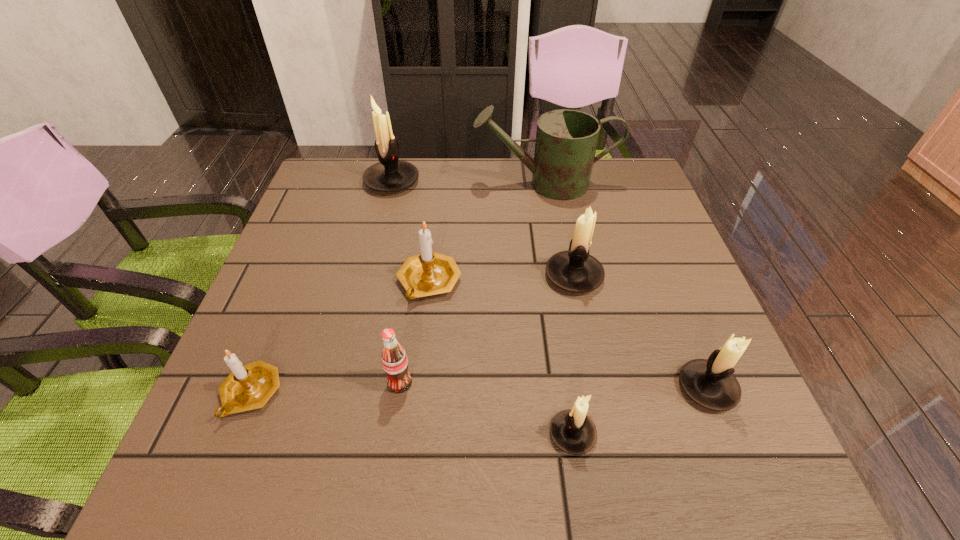
Image resolution: width=960 pixels, height=540 pixels. I want to click on vacant region located 0.210m on the back of the soda, so click(x=413, y=290).

Find the location of a particular element. The image size is (960, 540). free region located on the right of the leftmost object is located at coordinates (348, 393).

You are a GUI agent. You are given a task and a screenshot of the screen. Output one action in this format:
    pyautogui.click(x=<x>, y=<y>)
    Task: Click on the free space located 0.080m on the left of the smallest white candle holder
    
    Given the screenshot: What is the action you would take?
    pyautogui.click(x=502, y=434)

You are a GUI agent. You are given a task and a screenshot of the screen. Output one action in this format:
    pyautogui.click(x=<x>, y=<y>)
    Task: Click on the candle holder located at the far edge
    
    Given the screenshot: What is the action you would take?
    pyautogui.click(x=390, y=174)

Locate an element on the screen. The height and width of the screenshot is (540, 960). watering can at the far edge is located at coordinates (566, 140).

The width and height of the screenshot is (960, 540). Find the location of `object present at the near edge`. object present at the near edge is located at coordinates (572, 431).

Find the location of a particular element. watering can that is at the right edge is located at coordinates (566, 140).

Identify the location of candle holder that is positioned at the right edge. This screenshot has width=960, height=540. (710, 383).

I want to click on object present at the far left corner, so click(x=390, y=174).

Find the location of a particular element. This screenshot has height=540, width=960. object at the far right corner is located at coordinates (566, 140).